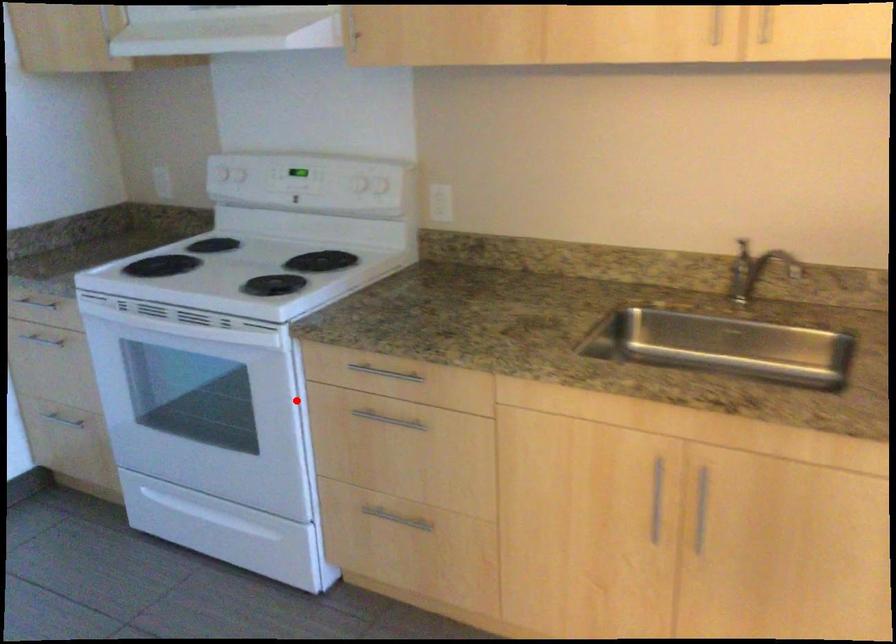
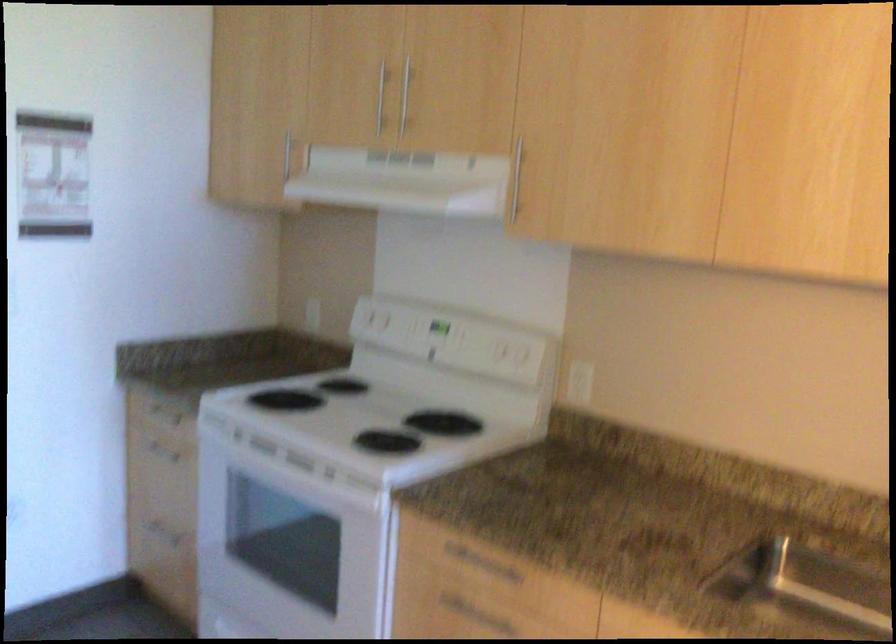
Find the pixel in the second image that matches the highlighted location in the first image.

(385, 571)